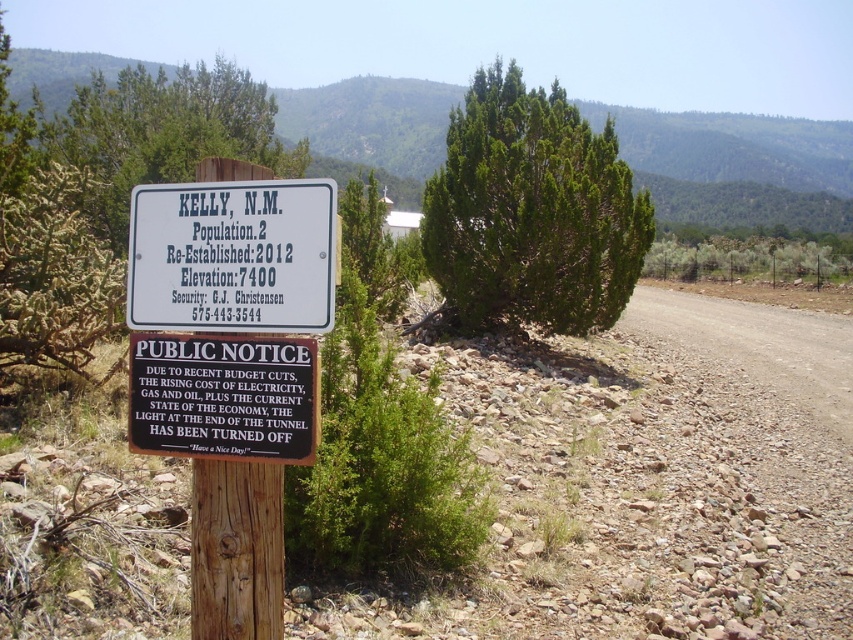
You are a hiker who just arrived at the signboard and want to read the notice on the lower section of the signboard. Which object, the green coniferous tree at center or the wooden post at center, would you need to move closer to in order to read the notice?

The green coniferous tree at center is further to the viewer than wooden post at center, so you would need to move closer to the wooden post at center to read the notice.

You are a hiker who just arrived at Kelly, N.M. You see the brown wooden sign at lower left and the wooden post at center. Which object is located to the left of the other?

The brown wooden sign at lower left is positioned on the left side of wooden post at center, so the brown wooden sign at lower left is to the left of the wooden post at center.